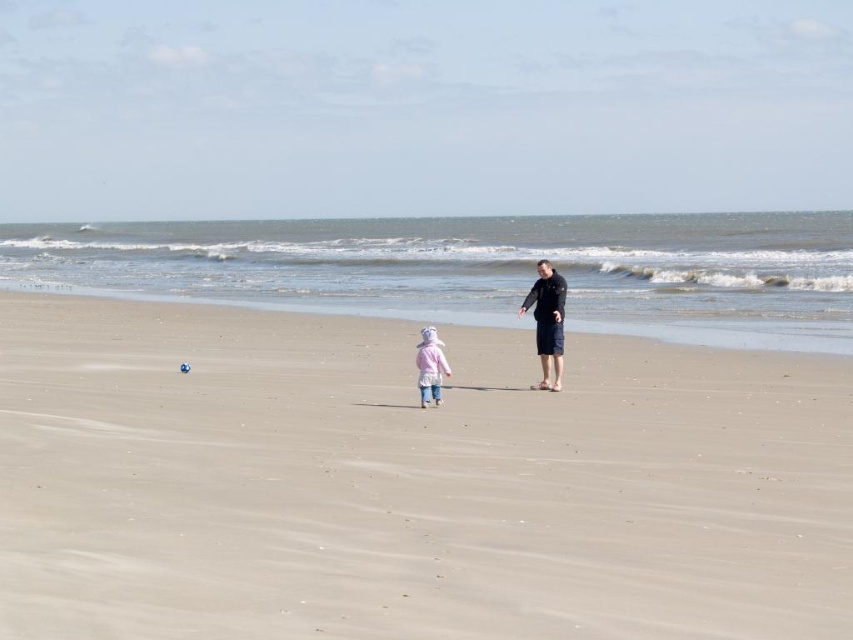
Question: Among these objects, which one is nearest to the camera?

Choices:
 (A) smooth sand at center
 (B) pink fleece jacket at center
 (C) dark blue fabric shorts at center

Answer: (A)

Question: Is smooth sand at center to the right of pink fleece jacket at center from the viewer's perspective?

Choices:
 (A) yes
 (B) no

Answer: (B)

Question: Is smooth sand at shoreline center below dark blue fabric shorts at center?

Choices:
 (A) no
 (B) yes

Answer: (A)

Question: Is smooth sand at shoreline center wider than dark blue fabric shorts at center?

Choices:
 (A) no
 (B) yes

Answer: (B)

Question: Which point is farther to the camera?

Choices:
 (A) (543, 296)
 (B) (432, 378)
 (C) (846, 312)
 (D) (51, 547)

Answer: (C)

Question: Which object is closer to the camera taking this photo?

Choices:
 (A) dark blue fabric shorts at center
 (B) smooth sand at center

Answer: (B)